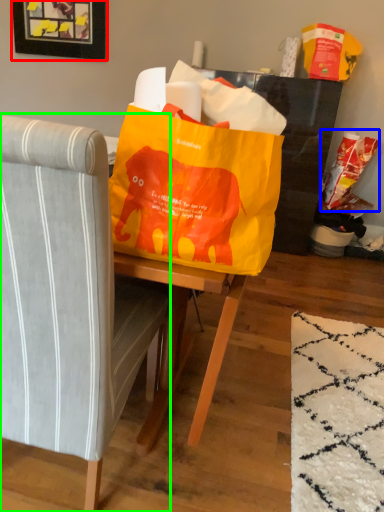
Question: Which object is the closest to the picture frame (highlighted by a red box)? Choose among these: grocery bag (highlighted by a blue box) or chair (highlighted by a green box).

Choices:
 (A) grocery bag
 (B) chair

Answer: (A)